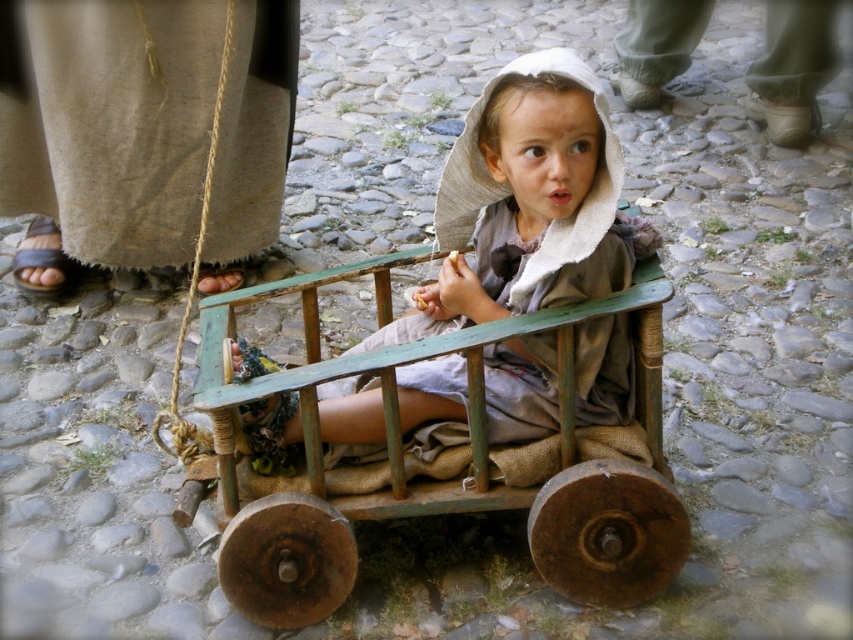
Question: Considering the relative positions of green painted wood wagon at center and matte green cart at center in the image provided, where is green painted wood wagon at center located with respect to matte green cart at center?

Choices:
 (A) below
 (B) above

Answer: (A)

Question: Can you confirm if green painted wood wagon at center is positioned to the right of matte green cart at center?

Choices:
 (A) yes
 (B) no

Answer: (B)

Question: Can you confirm if green painted wood wagon at center is smaller than matte green cart at center?

Choices:
 (A) yes
 (B) no

Answer: (B)

Question: Among these points, which one is farthest from the camera?

Choices:
 (A) (646, 593)
 (B) (343, 385)

Answer: (B)